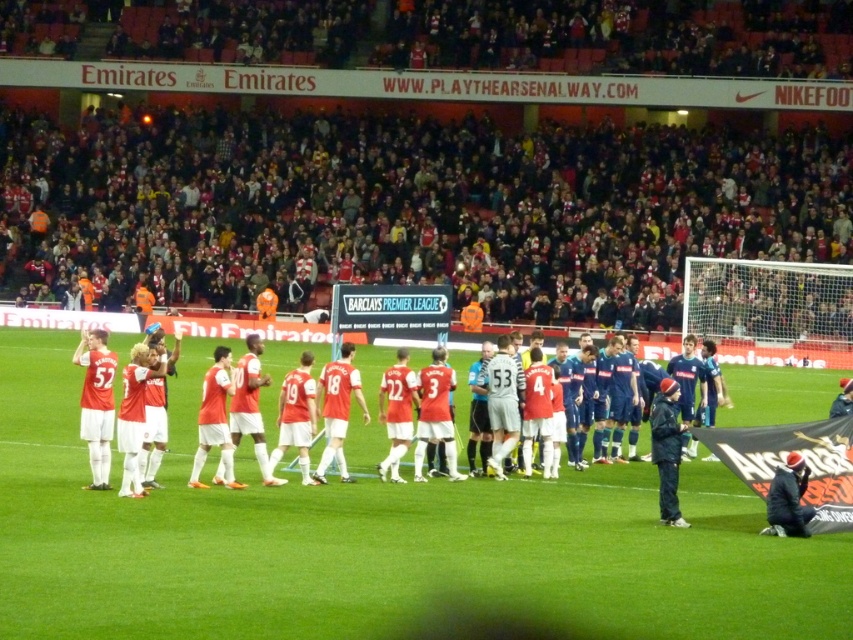
Is green grass field at center positioned behind dark blue jacket at center?

No, it is not.

Which is above, green grass field at center or dark blue jacket at center?

dark blue jacket at center is above.

Is point (16, 332) behind point (671, 429)?

Yes, it is.

This screenshot has height=640, width=853. I want to click on green grass field at center, so click(375, 540).

Which is in front, point (151, 566) or point (296, 445)?

Point (151, 566) is more forward.

Does green grass field at center appear on the left side of matte red jersey at center?

Incorrect, green grass field at center is not on the left side of matte red jersey at center.

Does point (10, 364) lie in front of point (135, 376)?

No, (10, 364) is behind (135, 376).

You are a GUI agent. You are given a task and a screenshot of the screen. Output one action in this format:
    pyautogui.click(x=<x>, y=<y>)
    Task: Click on the green grass field at center
    The width and height of the screenshot is (853, 640).
    Given the screenshot: What is the action you would take?
    pyautogui.click(x=375, y=540)

Between point (160, 385) and point (677, 428), which one is positioned in front?

Point (677, 428)

In the scene shown: Between matte red jersey at center and dark blue jacket at center, which one is positioned lower?

dark blue jacket at center is lower down.

Find the location of a particular element. matte red jersey at center is located at coordinates (228, 401).